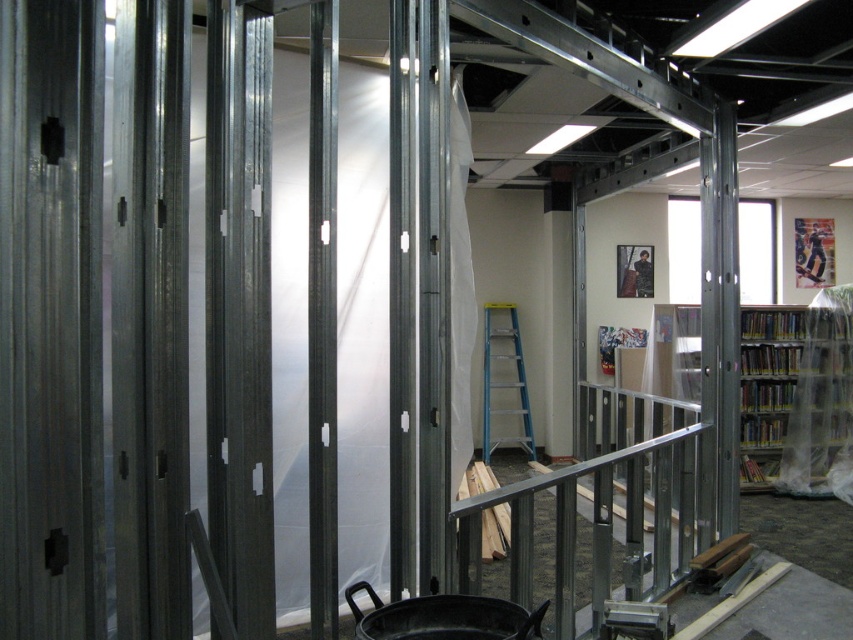
Is clear plastic bookshelf at right smaller than blue aluminum ladder at center?

No, clear plastic bookshelf at right is not smaller than blue aluminum ladder at center.

Is clear plastic bookshelf at right bigger than blue aluminum ladder at center?

Yes, clear plastic bookshelf at right is bigger than blue aluminum ladder at center.

Who is more forward, (802, 451) or (529, 406)?

Point (802, 451) is more forward.

This screenshot has height=640, width=853. I want to click on clear plastic bookshelf at right, so (x=793, y=390).

Is metallic silver rail at center positioned at the back of blue aluminum ladder at center?

That is False.

Can you confirm if metallic silver rail at center is positioned below blue aluminum ladder at center?

Indeed, metallic silver rail at center is positioned under blue aluminum ladder at center.

Between point (515, 524) and point (508, 401), which one is positioned behind?

The point (508, 401) is behind.

You are a GUI agent. You are given a task and a screenshot of the screen. Output one action in this format:
    pyautogui.click(x=<x>, y=<y>)
    Task: Click on the metallic silver rail at center
    
    Given the screenshot: What is the action you would take?
    pyautogui.click(x=606, y=509)

Can you confirm if metallic silver rail at center is smaller than clear plastic bookshelf at right?

No, metallic silver rail at center is not smaller than clear plastic bookshelf at right.

Is metallic silver rail at center shorter than clear plastic bookshelf at right?

Indeed, metallic silver rail at center has a lesser height compared to clear plastic bookshelf at right.

Where is `metallic silver rail at center`? Image resolution: width=853 pixels, height=640 pixels. metallic silver rail at center is located at coordinates (606, 509).